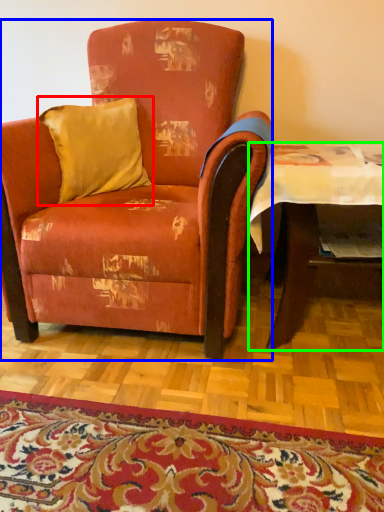
Question: Based on their relative distances, which object is nearer to pillow (highlighted by a red box)? Choose from chair (highlighted by a blue box) and table (highlighted by a green box).

Choices:
 (A) chair
 (B) table

Answer: (A)